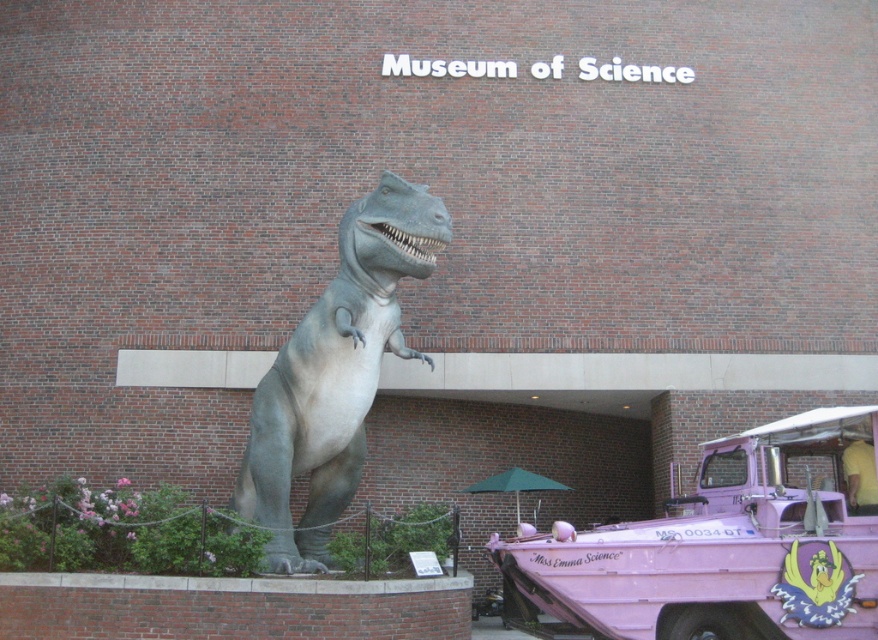
Question: Which point is closer to the camera?

Choices:
 (A) (343, 321)
 (B) (558, 538)

Answer: (B)

Question: Does pink matte amphibious vehicle at lower right come behind gray matte dinosaur at center?

Choices:
 (A) yes
 (B) no

Answer: (B)

Question: Does pink matte amphibious vehicle at lower right appear under gray matte dinosaur at center?

Choices:
 (A) yes
 (B) no

Answer: (A)

Question: Which point is farther to the camera?

Choices:
 (A) (548, 595)
 (B) (277, 416)

Answer: (B)

Question: From the image, what is the correct spatial relationship of pink matte amphibious vehicle at lower right in relation to gray matte dinosaur at center?

Choices:
 (A) left
 (B) right

Answer: (B)

Question: Which point is farther to the camera?

Choices:
 (A) (328, 387)
 (B) (872, 508)

Answer: (A)